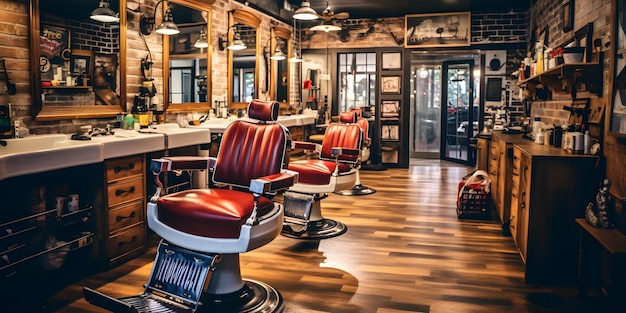
I want to click on bowl, so click(580, 59).